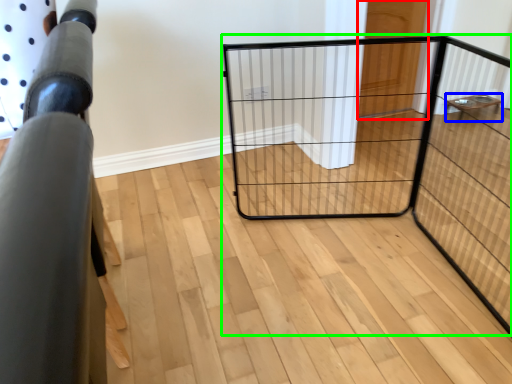
Question: Which object is the closest to the door (highlighted by a red box)? Choose among these: furniture (highlighted by a blue box) or cage (highlighted by a green box).

Choices:
 (A) furniture
 (B) cage

Answer: (B)